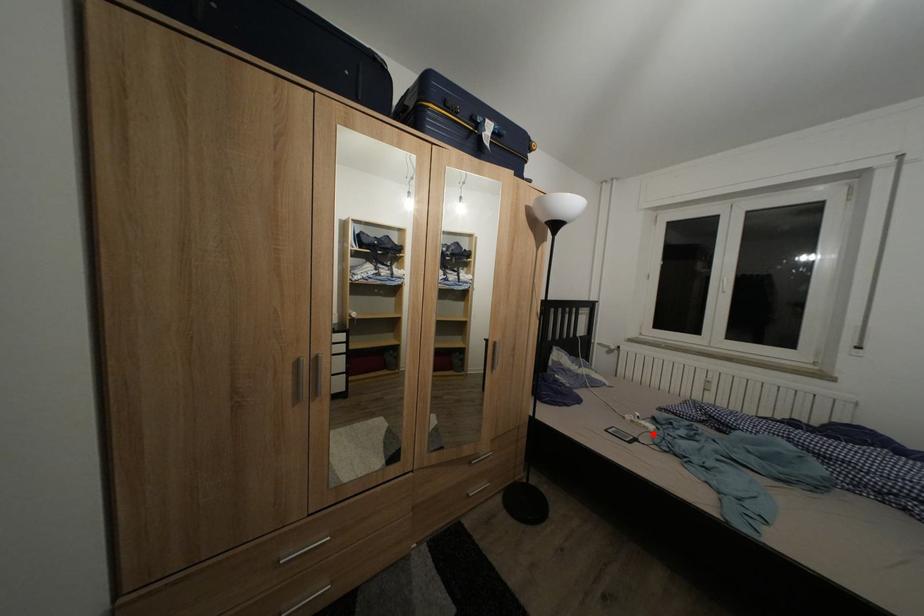
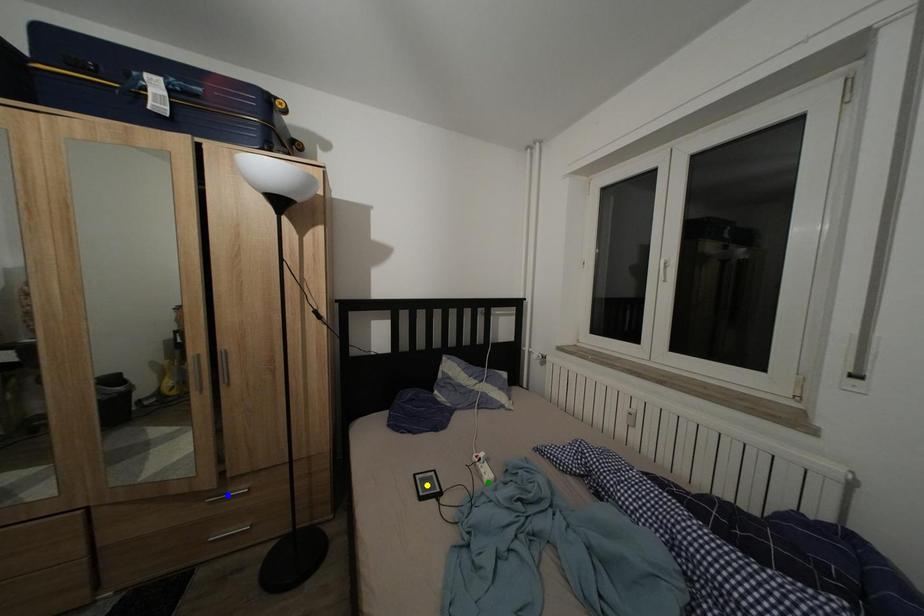
Question: I am providing you with two images of the same scene from different viewpoints. A red point is marked on the first image. You are given multiple points on the second image. Which spot in image 2 lines up with the point in image 1?

Choices:
 (A) yellow point
 (B) green point
 (C) blue point

Answer: (B)